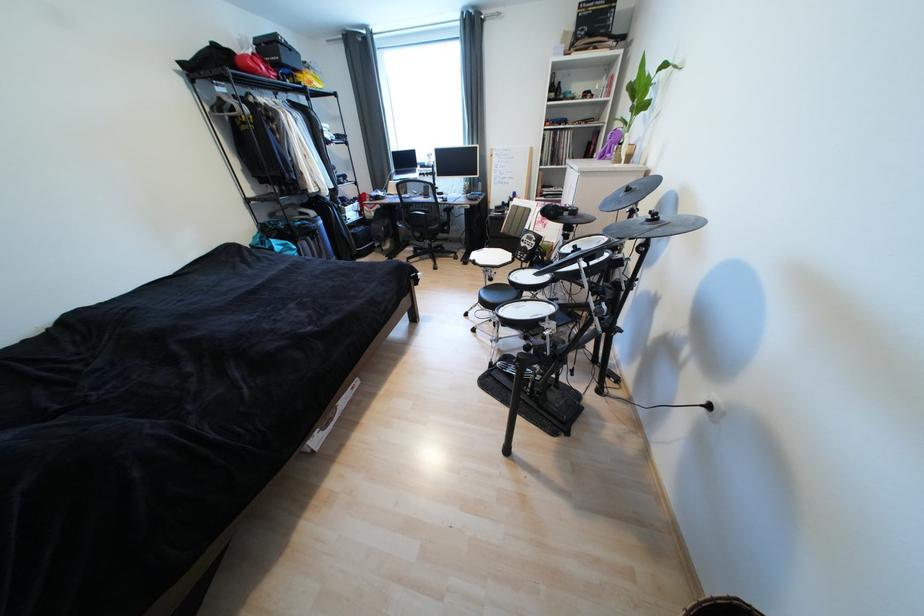
Identify the location of woven basket. (736, 598).